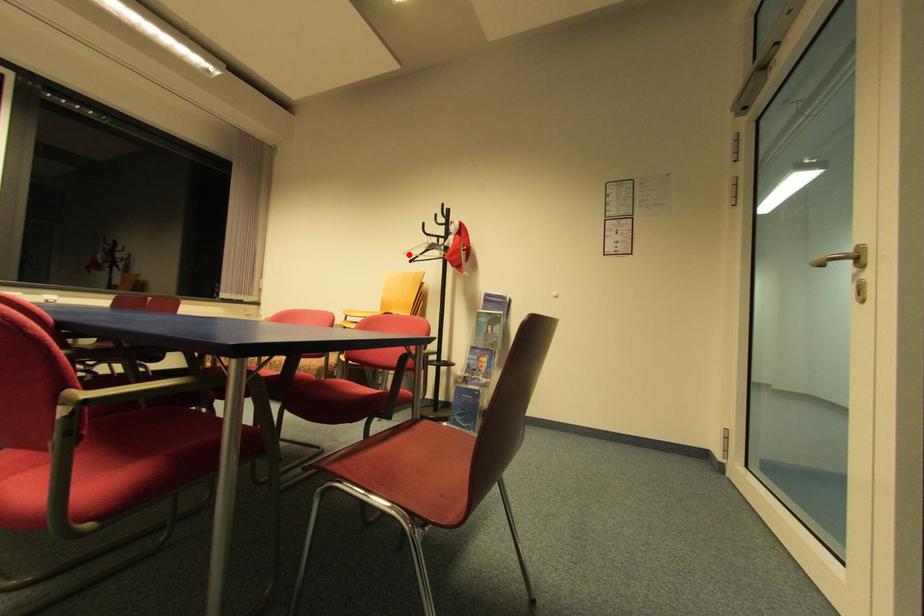
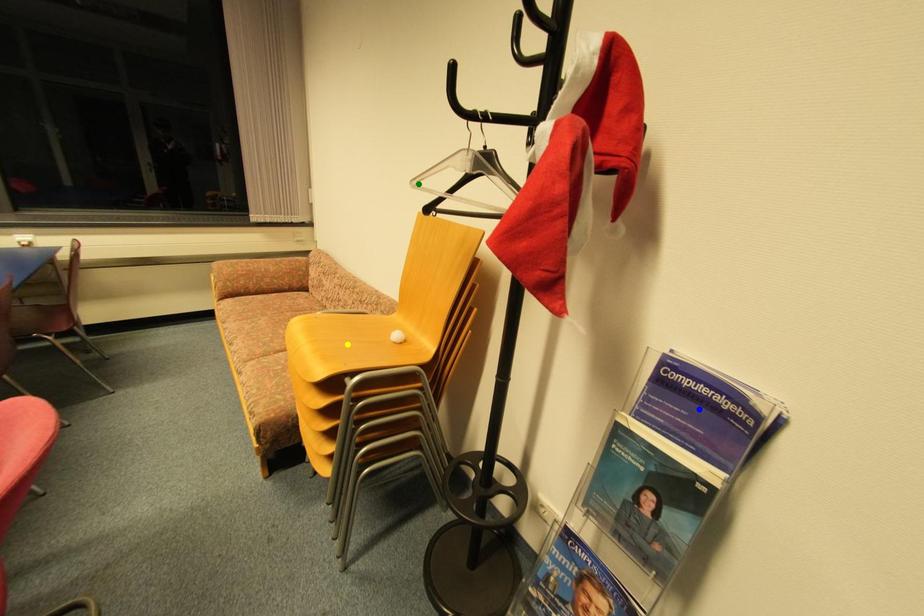
Question: I am providing you with two images of the same scene from different viewpoints. A red point is marked on the first image. You are given multiple points on the second image. Which mark in image 2 goes with the point in image 1?

Choices:
 (A) yellow point
 (B) blue point
 (C) green point

Answer: (C)